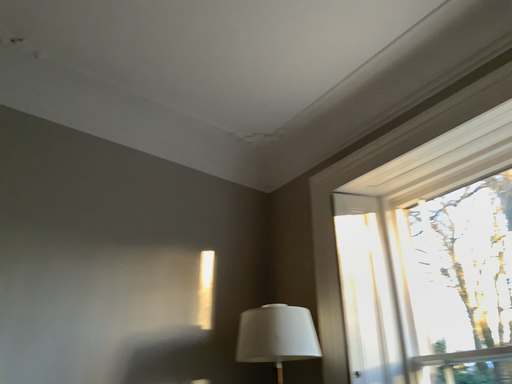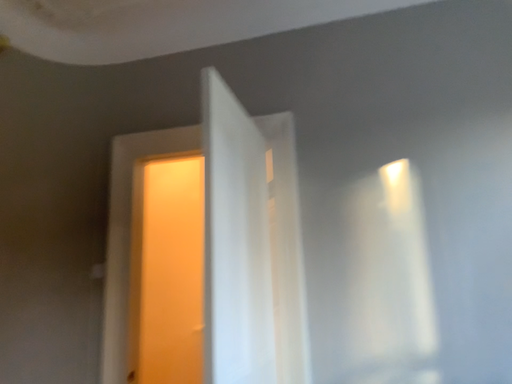
Question: How did the camera likely rotate when shooting the video?

Choices:
 (A) rotated upward
 (B) rotated downward

Answer: (B)